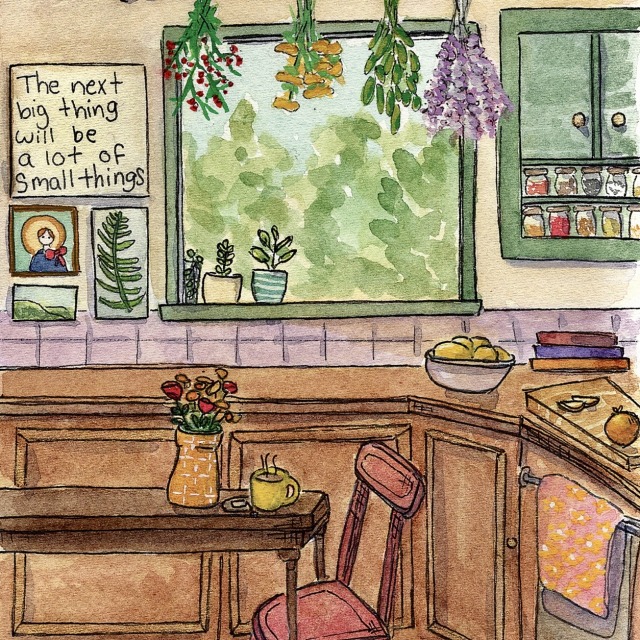
Identify the location of books. This screenshot has width=640, height=640. (588, 340), (587, 349), (585, 364).